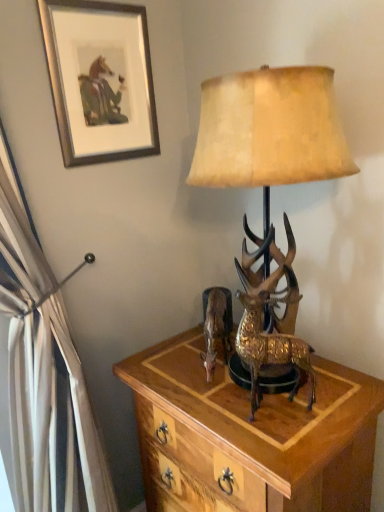
The width and height of the screenshot is (384, 512). I want to click on free location to the left of gold textured deer at center, so click(x=211, y=407).